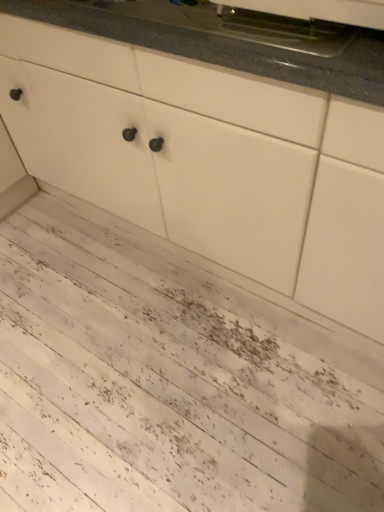
Measure the distance between point (278, 24) and camera.

38.82 inches.

Describe the element at coordinates (232, 40) in the screenshot. This screenshot has width=384, height=512. I see `granite gray countertop at upper center` at that location.

Locate an element on the screen. The height and width of the screenshot is (512, 384). white textured wood at lower left is located at coordinates (166, 389).

Measure the distance between point (92, 298) and camera.

They are 1.60 meters apart.

Identify the location of metallic stainless steel oven at upper center. This screenshot has width=384, height=512. pyautogui.click(x=299, y=23).

Would you say metallic stainless steel oven at upper center contains white matte cabinet at center?

Definitely not — white matte cabinet at center is not inside metallic stainless steel oven at upper center.

Between metallic stainless steel oven at upper center and white matte cabinet at center, which one has smaller width?

metallic stainless steel oven at upper center is thinner.

Is metallic stainless steel oven at upper center shorter than white matte cabinet at center?

Yes.

From a real-world perspective, is metallic stainless steel oven at upper center physically below white matte cabinet at center?

No, from a real-world perspective, metallic stainless steel oven at upper center is not under white matte cabinet at center.

Is white textured wood at lower left closer to the viewer compared to metallic stainless steel oven at upper center?

No, white textured wood at lower left is further to the viewer.

Considering the positions of objects white textured wood at lower left and metallic stainless steel oven at upper center in the image provided, who is more to the left, white textured wood at lower left or metallic stainless steel oven at upper center?

white textured wood at lower left is more to the left.

Between white textured wood at lower left and metallic stainless steel oven at upper center, which one has less height?

With less height is white textured wood at lower left.

Are white textured wood at lower left and metallic stainless steel oven at upper center making contact?

No, white textured wood at lower left is not making contact with metallic stainless steel oven at upper center.

Does point (119, 96) come closer to viewer compared to point (239, 500)?

No, (119, 96) is behind (239, 500).

Considering the sizes of white matte cabinet at center and white textured wood at lower left in the image, is white matte cabinet at center bigger or smaller than white textured wood at lower left?

Considering their sizes, white matte cabinet at center takes up more space than white textured wood at lower left.

Consider the image. Considering the positions of objects white matte cabinet at center and white textured wood at lower left in the image provided, who is in front, white matte cabinet at center or white textured wood at lower left?

white matte cabinet at center is more forward.

Can you confirm if white matte cabinet at center is wider than white textured wood at lower left?

No.

From the image's perspective, is metallic stainless steel oven at upper center located above granite gray countertop at upper center?

No, from the image's perspective, metallic stainless steel oven at upper center is not above granite gray countertop at upper center.

Which of these two, metallic stainless steel oven at upper center or granite gray countertop at upper center, stands taller?

granite gray countertop at upper center is taller.

Based on the photo, is metallic stainless steel oven at upper center bigger or smaller than granite gray countertop at upper center?

Considering their sizes, metallic stainless steel oven at upper center takes up less space than granite gray countertop at upper center.

Can we say metallic stainless steel oven at upper center lies outside granite gray countertop at upper center?

That's correct, metallic stainless steel oven at upper center is outside of granite gray countertop at upper center.

From the image's perspective, which one is positioned higher, metallic stainless steel oven at upper center or white textured wood at lower left?

metallic stainless steel oven at upper center, from the image's perspective.

Considering the positions of objects metallic stainless steel oven at upper center and white textured wood at lower left in the image provided, who is in front, metallic stainless steel oven at upper center or white textured wood at lower left?

metallic stainless steel oven at upper center is closer to the camera.

Is metallic stainless steel oven at upper center not close to white textured wood at lower left?

That's not correct — metallic stainless steel oven at upper center is a little close to white textured wood at lower left.

Measure the distance from metallic stainless steel oven at upper center to white textured wood at lower left.

39.04 inches.

From the image's perspective, which one is positioned lower, white textured wood at lower left or granite gray countertop at upper center?

white textured wood at lower left appears lower in the image.

Considering the relative positions of white textured wood at lower left and granite gray countertop at upper center in the image provided, is white textured wood at lower left to the right of granite gray countertop at upper center from the viewer's perspective?

No, white textured wood at lower left is not to the right of granite gray countertop at upper center.

Are white textured wood at lower left and granite gray countertop at upper center located far from each other?

That's not correct — white textured wood at lower left is a little close to granite gray countertop at upper center.

In the image, is white textured wood at lower left positioned in front of or behind granite gray countertop at upper center?

In the image, white textured wood at lower left appears behind granite gray countertop at upper center.

From a real-world perspective, is white matte cabinet at center physically located above or below granite gray countertop at upper center?

white matte cabinet at center is situated lower than granite gray countertop at upper center in the real world.

Is white matte cabinet at center placed right next to granite gray countertop at upper center?

No, white matte cabinet at center is not with granite gray countertop at upper center.

Measure the distance between white matte cabinet at center and granite gray countertop at upper center.

They are 9.24 inches apart.

Is white matte cabinet at center turned away from granite gray countertop at upper center?

No, white matte cabinet at center is not facing the opposite direction of granite gray countertop at upper center.

Find the location of `cabinetry on the left of metallic stainless steel oven at upper center`. cabinetry on the left of metallic stainless steel oven at upper center is located at coordinates (206, 151).

In order to click on appliance in front of the white textured wood at lower left in this screenshot , I will do `click(299, 23)`.

Based on their spatial positions, is white textured wood at lower left or granite gray countertop at upper center closer to white matte cabinet at center?

granite gray countertop at upper center is positioned closer to the anchor white matte cabinet at center.

Considering their positions, is granite gray countertop at upper center positioned closer to white matte cabinet at center than white textured wood at lower left?

granite gray countertop at upper center lies closer to white matte cabinet at center than the other object.

Which object lies nearer to the anchor point granite gray countertop at upper center, white matte cabinet at center or white textured wood at lower left?

Based on the image, white matte cabinet at center appears to be nearer to granite gray countertop at upper center.

Looking at the image, which one is located further to granite gray countertop at upper center, metallic stainless steel oven at upper center or white textured wood at lower left?

white textured wood at lower left is further to granite gray countertop at upper center.

Which object lies nearer to the anchor point metallic stainless steel oven at upper center, white matte cabinet at center or white textured wood at lower left?

white matte cabinet at center.

Considering their positions, is granite gray countertop at upper center positioned closer to white matte cabinet at center than metallic stainless steel oven at upper center?

The object closer to white matte cabinet at center is granite gray countertop at upper center.

Based on their spatial positions, is white matte cabinet at center or metallic stainless steel oven at upper center closer to granite gray countertop at upper center?

metallic stainless steel oven at upper center.

Estimate the real-world distances between objects in this image. Which object is further from metallic stainless steel oven at upper center, white textured wood at lower left or granite gray countertop at upper center?

white textured wood at lower left.

At what (x,y) coordinates should I click in order to perform the action: click on cabinetry between metallic stainless steel oven at upper center and white textured wood at lower left in the vertical direction. Please return your answer as a coordinate pair (x, y). This screenshot has height=512, width=384. Looking at the image, I should click on (206, 151).

At what (x,y) coordinates should I click in order to perform the action: click on appliance between granite gray countertop at upper center and white textured wood at lower left in the up-down direction. Please return your answer as a coordinate pair (x, y). Looking at the image, I should click on (299, 23).

Identify the location of appliance between granite gray countertop at upper center and white matte cabinet at center from top to bottom. This screenshot has width=384, height=512. (299, 23).

You are a GUI agent. You are given a task and a screenshot of the screen. Output one action in this format:
    pyautogui.click(x=<x>, y=<y>)
    Task: Click on the cabinetry between granite gray countertop at upper center and white textured wood at lower left vertically
    Image resolution: width=384 pixels, height=512 pixels.
    Given the screenshot: What is the action you would take?
    pyautogui.click(x=206, y=151)